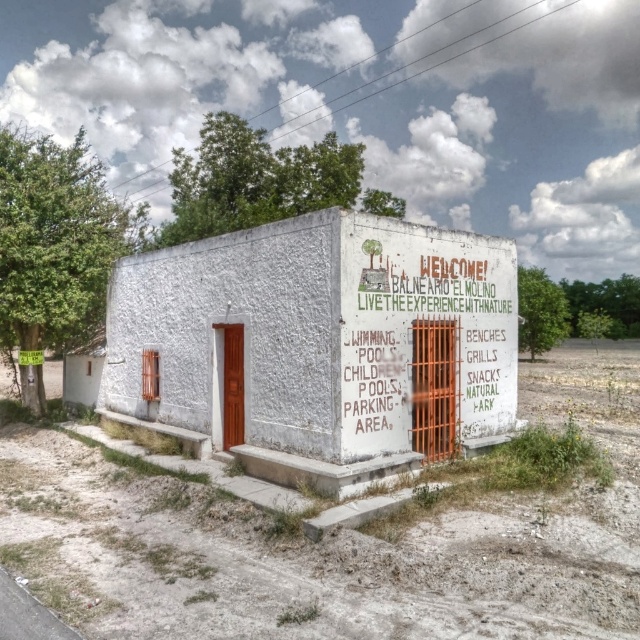
Question: Can you confirm if white stucco sign at center is bigger than white painted signboard at center?

Choices:
 (A) no
 (B) yes

Answer: (B)

Question: Does white stucco sign at center have a larger size compared to white painted signboard at center?

Choices:
 (A) no
 (B) yes

Answer: (B)

Question: Among these objects, which one is nearest to the camera?

Choices:
 (A) white painted signboard at center
 (B) white stucco sign at center

Answer: (B)

Question: Which object appears farthest from the camera in this image?

Choices:
 (A) white stucco sign at center
 (B) white painted signboard at center

Answer: (B)

Question: Is white stucco sign at center wider than white painted signboard at center?

Choices:
 (A) no
 (B) yes

Answer: (B)

Question: Which object is farther from the camera taking this photo?

Choices:
 (A) white stucco sign at center
 (B) white painted signboard at center

Answer: (B)